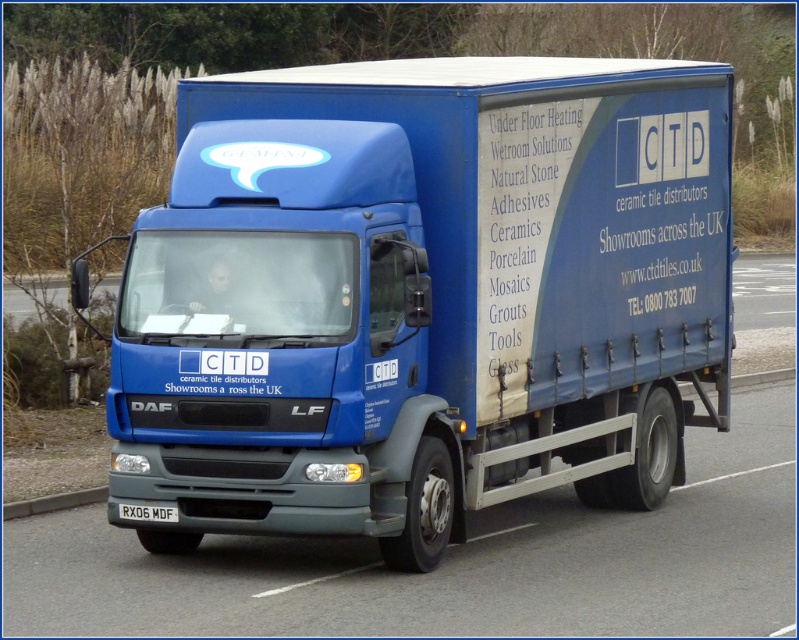
Can you confirm if matte blue truck at center is positioned to the left of white plastic license plate at bottom?

No, matte blue truck at center is not to the left of white plastic license plate at bottom.

Is matte blue truck at center further to the viewer compared to white plastic license plate at bottom?

Yes.

Who is more forward, (446, 326) or (130, 513)?

Positioned in front is point (130, 513).

I want to click on matte blue truck at center, so click(x=423, y=296).